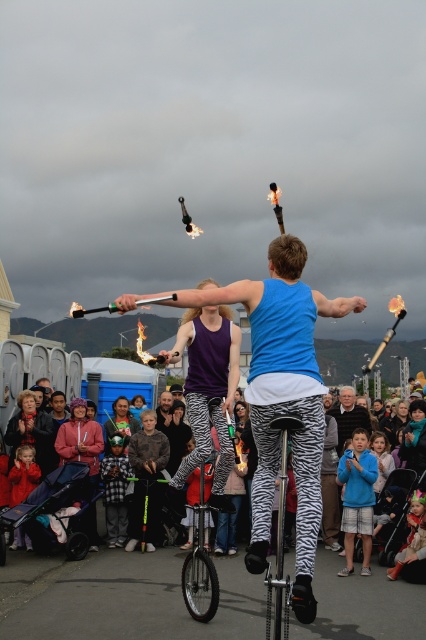
Based on the photo, you are a photographer at the event and want to capture both performers in a single shot. The first performer is at point (259, 420) and the second performer is at point (238, 465). Since you want to ensure both are in focus, which performer should you focus on first to maintain clarity?

Point (259, 420) is in front of point (238, 465), so you should focus on the performer at point (259, 420) first to ensure both are in focus.

You are standing at the edge of the performance area and notice the multicolored fabric crowd at center. Based on their position, can you estimate whether they are closer to the front or the back of the performance area?

The multicolored fabric crowd at center is located at point (46, 493), which suggests they are positioned closer to the front of the performance area since the coordinates indicate a lower y value, typically representing the front in such coordinate systems.

You are a photographer trying to capture a clear shot of the zebra print monocycle at lower left without the multicolored fabric crowd at center blocking it. Given their sizes, will the crowd likely obscure the monocycle in your photo?

The multicolored fabric crowd at center has a larger size compared to zebra print monocycle at lower left, so the crowd is more likely to obscure the monocycle in your photo.